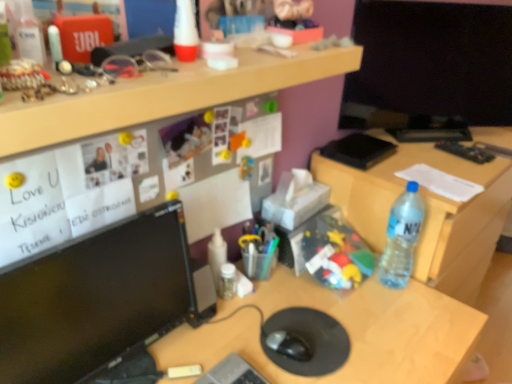
Locate an element on the screen. This screenshot has width=512, height=384. vacant space that is in between black matte mouse at center and translucent plastic bottle at center, which is the 1th bottle from left to right is located at coordinates (258, 317).